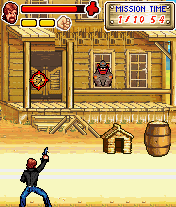
The width and height of the screenshot is (176, 207). Identify the location of saloons. (60, 64).